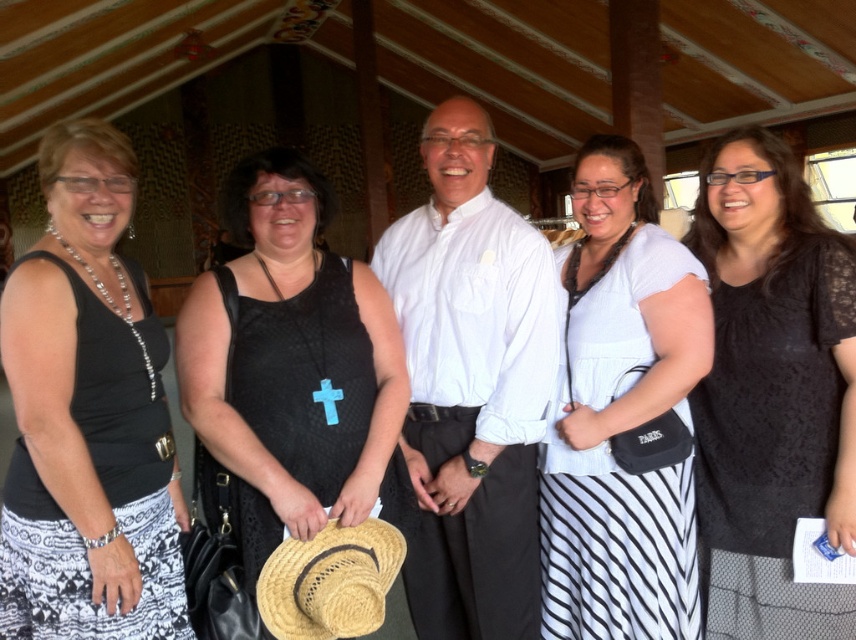
What do you see at coordinates (771, 394) in the screenshot? I see `black lace dress at center` at bounding box center [771, 394].

Where is `black lace dress at center`? black lace dress at center is located at coordinates (771, 394).

Does black matte tank top at left appear on the right side of white striped skirt at center?

Incorrect, black matte tank top at left is not on the right side of white striped skirt at center.

Which is below, black matte tank top at left or white striped skirt at center?

Positioned lower is white striped skirt at center.

This screenshot has width=856, height=640. Describe the element at coordinates (87, 417) in the screenshot. I see `black matte tank top at left` at that location.

Identify the location of black matte tank top at left. This screenshot has height=640, width=856. (87, 417).

Is point (758, 577) farther from viewer compared to point (268, 582)?

Yes, point (758, 577) is farther from viewer.

Between black lace dress at center and straw hat at center, which one has less height?

Standing shorter between the two is straw hat at center.

Which is in front, point (789, 515) or point (271, 611)?

Positioned in front is point (271, 611).

Where is `black lace dress at center`? The width and height of the screenshot is (856, 640). black lace dress at center is located at coordinates (771, 394).